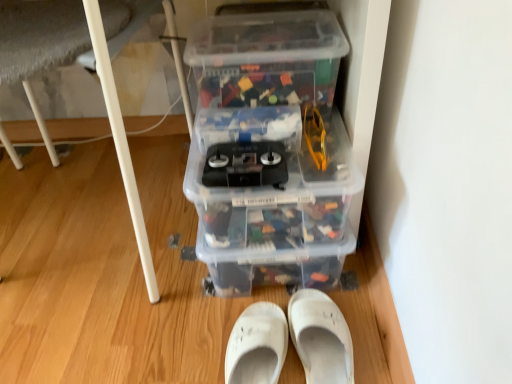
Question: Is white plastic table leg at lower left located within transparent plastic storage box at center, positioned as the first storage box in bottom-to-top order?

Choices:
 (A) no
 (B) yes

Answer: (A)

Question: From a real-world perspective, is transparent plastic storage box at center, positioned as the first storage box in bottom-to-top order, below white plastic table leg at lower left?

Choices:
 (A) no
 (B) yes

Answer: (B)

Question: Can you confirm if transparent plastic storage box at center, placed as the 2th storage box when sorted from top to bottom, is positioned to the left of white plastic table leg at lower left?

Choices:
 (A) no
 (B) yes

Answer: (A)

Question: Could you tell me if transparent plastic storage box at center, placed as the 2th storage box when sorted from top to bottom, is facing white plastic table leg at lower left?

Choices:
 (A) no
 (B) yes

Answer: (A)

Question: From the image's perspective, would you say transparent plastic storage box at center, positioned as the first storage box in bottom-to-top order, is shown under white plastic table leg at lower left?

Choices:
 (A) no
 (B) yes

Answer: (B)

Question: Is transparent plastic storage box at center, placed as the 2th storage box when sorted from top to bottom, at the right side of white plastic table leg at lower left?

Choices:
 (A) yes
 (B) no

Answer: (A)

Question: Is white matte shoe at lower center, placed as the first footwear when sorted from left to right, positioned beyond the bounds of white fabric slipper at lower center, positioned as the 2th footwear in left-to-right order?

Choices:
 (A) yes
 (B) no

Answer: (A)

Question: Does white matte shoe at lower center, placed as the first footwear when sorted from left to right, appear on the left side of white fabric slipper at lower center, the first footwear in the right-to-left sequence?

Choices:
 (A) yes
 (B) no

Answer: (A)

Question: Is white matte shoe at lower center, placed as the first footwear when sorted from left to right, further to the viewer compared to white fabric slipper at lower center, the first footwear in the right-to-left sequence?

Choices:
 (A) yes
 (B) no

Answer: (B)

Question: Considering the relative sizes of white matte shoe at lower center, positioned as the second footwear in right-to-left order, and white fabric slipper at lower center, the first footwear in the right-to-left sequence, in the image provided, is white matte shoe at lower center, positioned as the second footwear in right-to-left order, taller than white fabric slipper at lower center, the first footwear in the right-to-left sequence,?

Choices:
 (A) yes
 (B) no

Answer: (A)

Question: Would you say white matte shoe at lower center, placed as the first footwear when sorted from left to right, contains white fabric slipper at lower center, positioned as the 2th footwear in left-to-right order?

Choices:
 (A) yes
 (B) no

Answer: (B)

Question: Is white matte shoe at lower center, positioned as the second footwear in right-to-left order, aimed at white fabric slipper at lower center, the first footwear in the right-to-left sequence?

Choices:
 (A) no
 (B) yes

Answer: (A)

Question: Is transparent plastic storage box at upper center, positioned as the first storage box in top-to-bottom order, not near white plastic table leg at lower left?

Choices:
 (A) yes
 (B) no

Answer: (B)